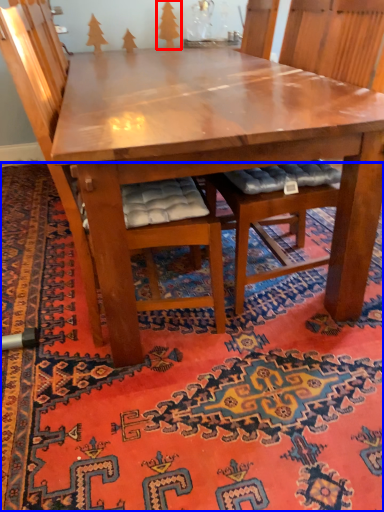
Question: Which point is further to the camera, tree (highlighted by a red box) or mat (highlighted by a blue box)?

Choices:
 (A) tree
 (B) mat

Answer: (A)